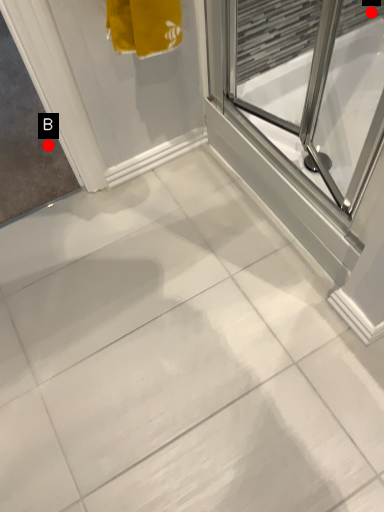
Question: Two points are circled on the image, labeled by A and B beside each circle. Among these points, which one is farthest from the camera?

Choices:
 (A) A is further
 (B) B is further

Answer: (B)